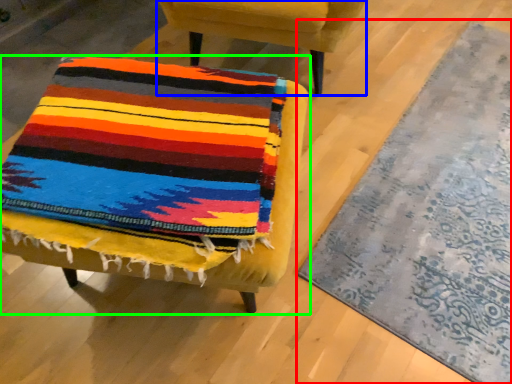
Question: Which is farther away from mat (highlighted by a red box)? chair (highlighted by a blue box) or chair (highlighted by a green box)?

Choices:
 (A) chair
 (B) chair

Answer: (A)